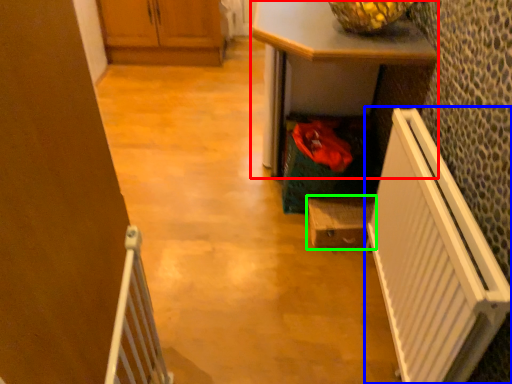
Question: Considering the real-world distances, which object is farthest from desk (highlighted by a red box)? radiator (highlighted by a blue box) or cabinetry (highlighted by a green box)?

Choices:
 (A) radiator
 (B) cabinetry

Answer: (B)